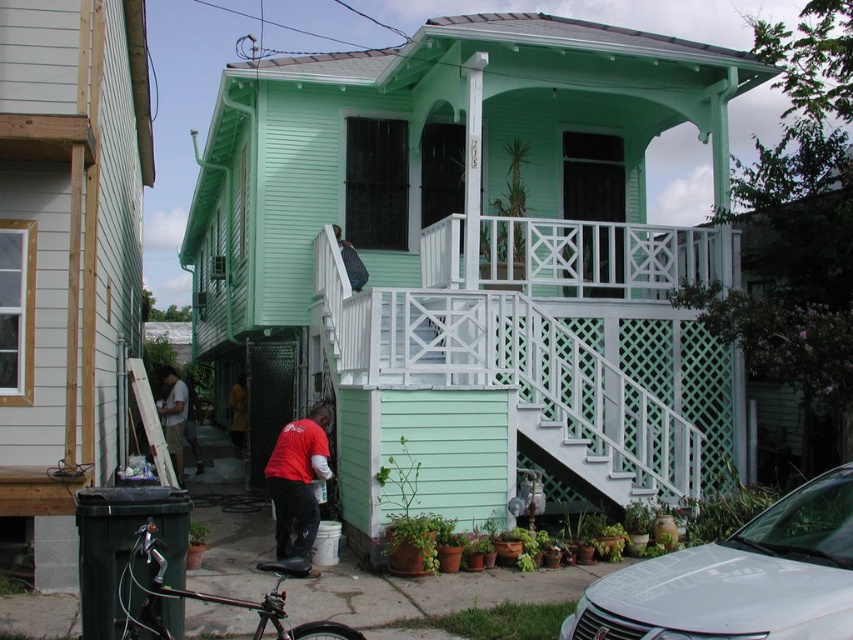
You are a delivery person trying to park your van next to the white glossy sedan at lower right. Can you park your van there without blocking the mint green wood porch at center?

The mint green wood porch at center is located above the white glossy sedan at lower right, so parking the van next to the white glossy sedan at lower right would not block the porch since it is positioned above the sedan.

You are planning to park your car next to the mint green wood porch at center. Given that your car is the same size as the white glossy sedan at lower right, will the porch be wide enough to accommodate your car?

The mint green wood porch at center is wider than the white glossy sedan at lower right, so yes, the porch is wide enough to accommodate your car since it is larger than the sedan.